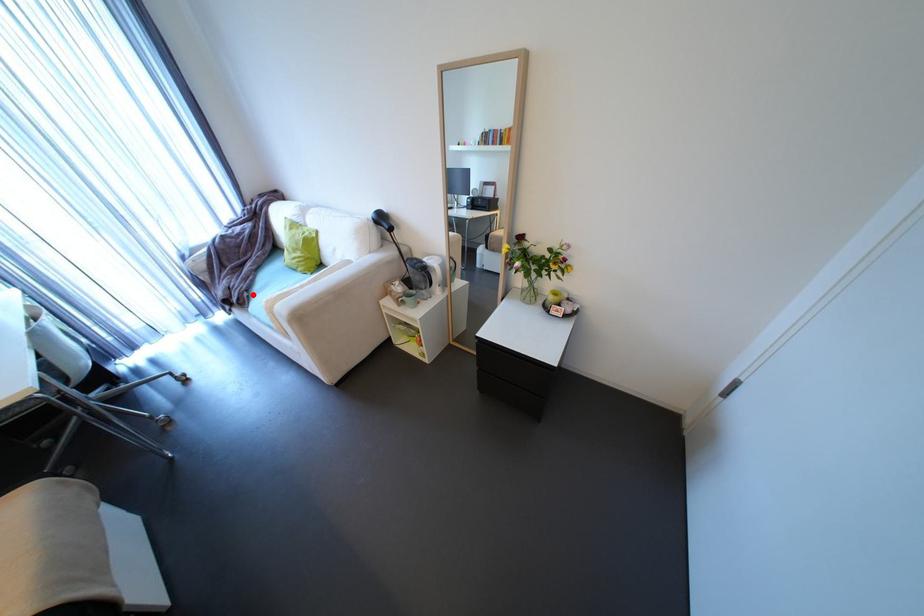
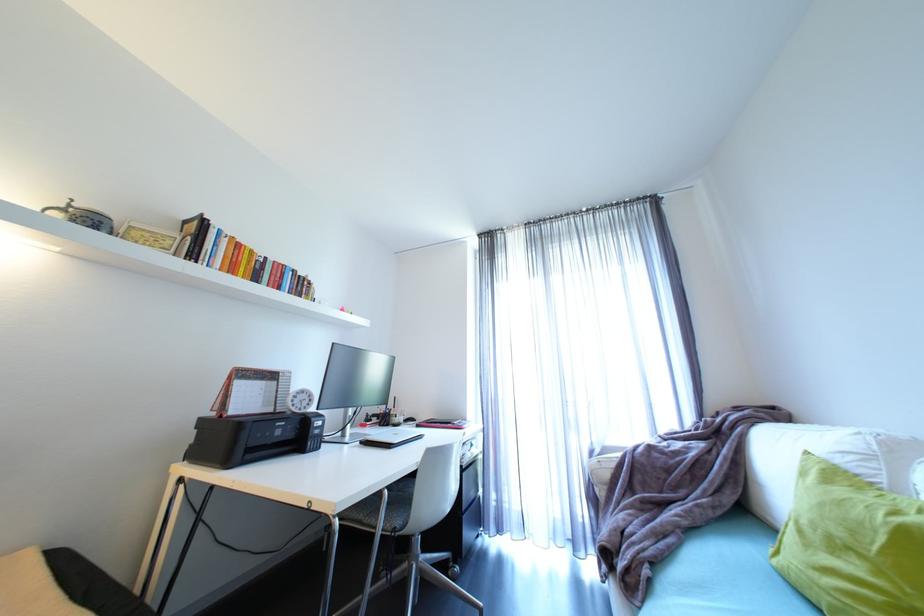
Locate, in the second image, the point that corresponds to the highlighted location in the first image.

(653, 572)